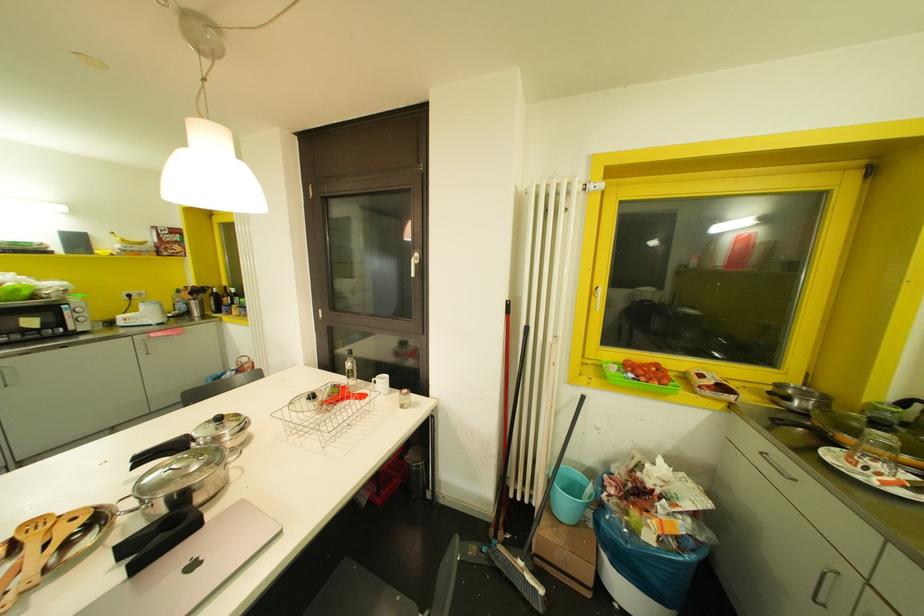
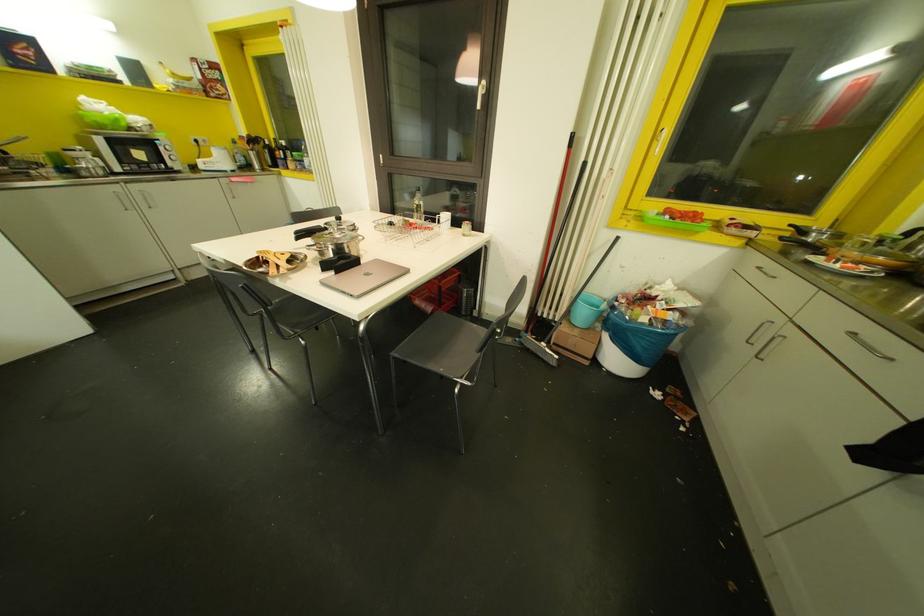
Locate, in the second image, the point that corresponds to (x=604, y=493) in the first image.

(614, 302)